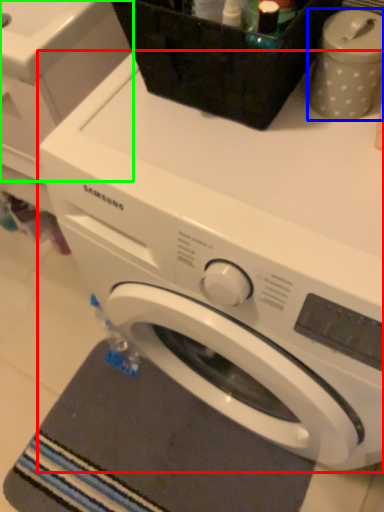
Question: Which object is positioned closest to washing machine (highlighted by a red box)? Select from appliance (highlighted by a blue box) and washing machine (highlighted by a green box).

Choices:
 (A) appliance
 (B) washing machine

Answer: (A)